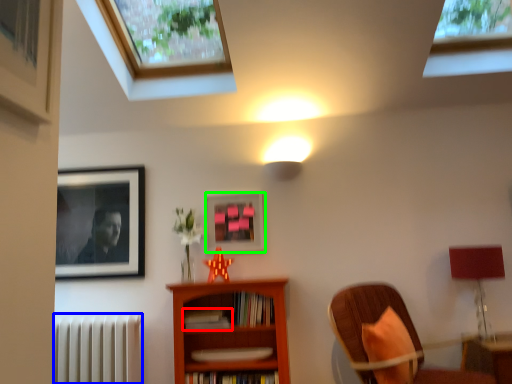
Question: Which object is the farthest from book (highlighted by a red box)? Choose among these: radiator (highlighted by a blue box) or picture frame (highlighted by a green box).

Choices:
 (A) radiator
 (B) picture frame

Answer: (A)